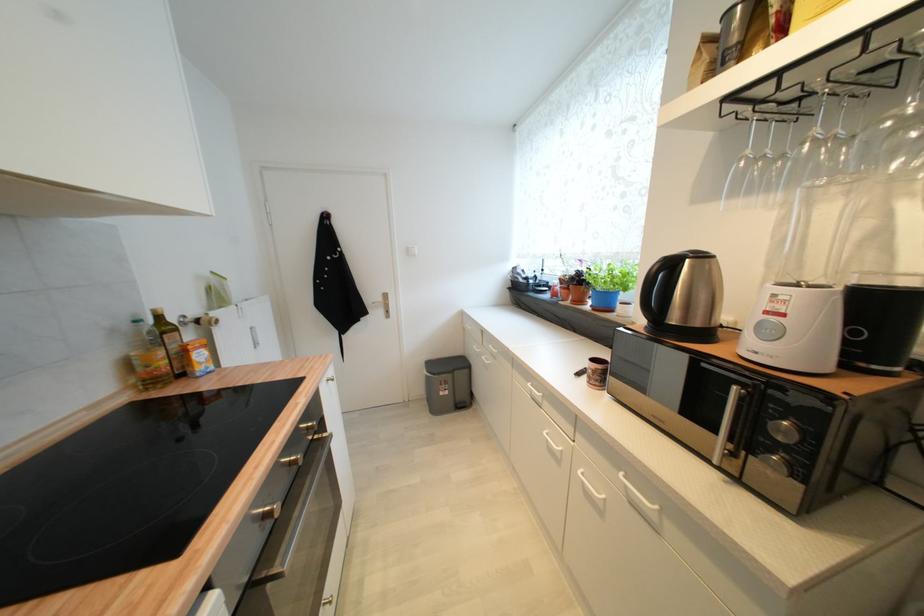
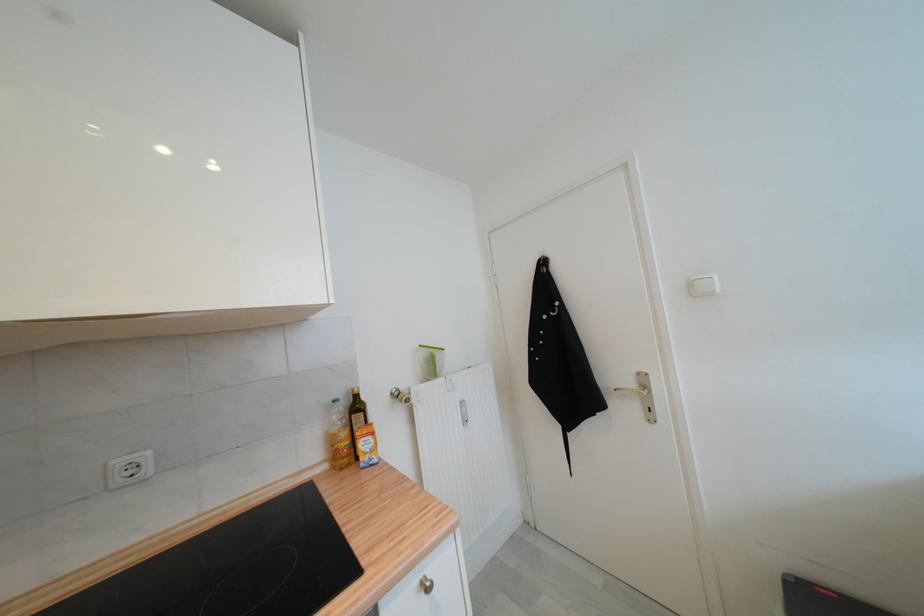
Find the pixel in the second image that matches (159,313) in the first image.

(358, 392)